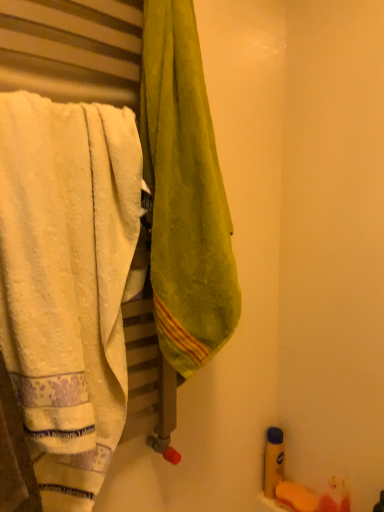
Question: Is yellow matte bottle at lower right to the left of green velvety towel at center, positioned as the first towel in right-to-left order, from the viewer's perspective?

Choices:
 (A) no
 (B) yes

Answer: (A)

Question: From the image's perspective, does yellow matte bottle at lower right appear lower than green velvety towel at center, the second towel positioned from the left?

Choices:
 (A) yes
 (B) no

Answer: (A)

Question: Does yellow matte bottle at lower right have a greater width compared to green velvety towel at center, the second towel positioned from the left?

Choices:
 (A) no
 (B) yes

Answer: (A)

Question: Is yellow matte bottle at lower right facing towards green velvety towel at center, the second towel positioned from the left?

Choices:
 (A) no
 (B) yes

Answer: (A)

Question: Is yellow matte bottle at lower right not close to green velvety towel at center, the second towel positioned from the left?

Choices:
 (A) no
 (B) yes

Answer: (A)

Question: Is yellow matte bottle at lower right to the right of green velvety towel at center, positioned as the first towel in right-to-left order, from the viewer's perspective?

Choices:
 (A) yes
 (B) no

Answer: (A)

Question: Is green velvety towel at center, positioned as the first towel in right-to-left order, oriented away from yellow matte bottle at lower right?

Choices:
 (A) yes
 (B) no

Answer: (B)

Question: Is green velvety towel at center, positioned as the first towel in right-to-left order, aimed at yellow matte bottle at lower right?

Choices:
 (A) yes
 (B) no

Answer: (B)

Question: From a real-world perspective, is green velvety towel at center, positioned as the first towel in right-to-left order, positioned under yellow matte bottle at lower right based on gravity?

Choices:
 (A) yes
 (B) no

Answer: (B)

Question: Can you confirm if green velvety towel at center, the second towel positioned from the left, is wider than yellow matte bottle at lower right?

Choices:
 (A) yes
 (B) no

Answer: (A)

Question: From a real-world perspective, is green velvety towel at center, positioned as the first towel in right-to-left order, located higher than yellow matte bottle at lower right?

Choices:
 (A) no
 (B) yes

Answer: (B)

Question: Does green velvety towel at center, positioned as the first towel in right-to-left order, lie behind yellow matte bottle at lower right?

Choices:
 (A) yes
 (B) no

Answer: (B)

Question: Is white soft towel at left, acting as the 2th towel starting from the right, far away from green velvety towel at center, the second towel positioned from the left?

Choices:
 (A) yes
 (B) no

Answer: (B)